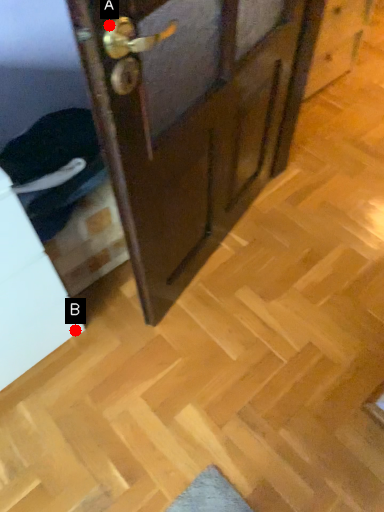
Question: Two points are circled on the image, labeled by A and B beside each circle. Which point appears farthest from the camera in this image?

Choices:
 (A) A is further
 (B) B is further

Answer: (B)